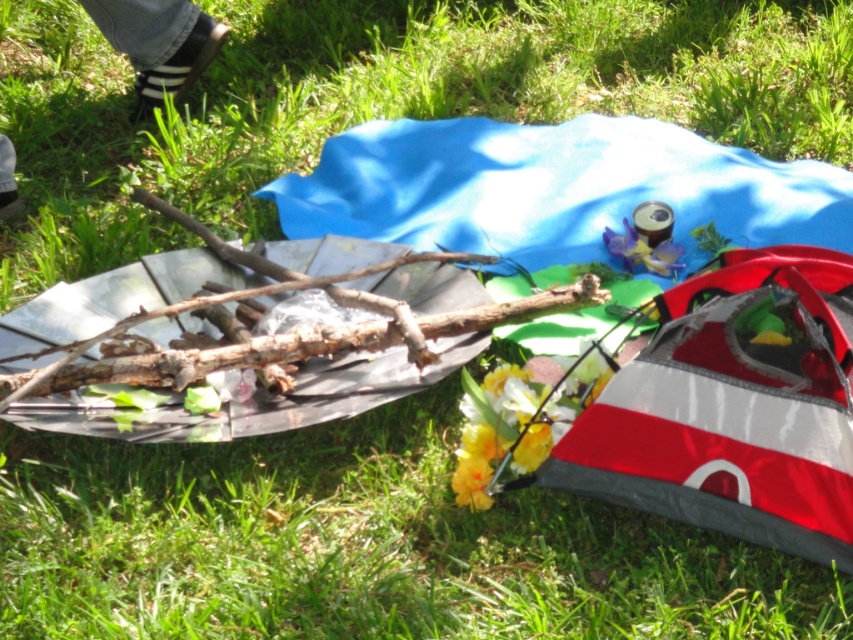
Measure the distance from yellow artificial flower at center to black leather shoe at upper left.

A distance of 1.98 meters exists between yellow artificial flower at center and black leather shoe at upper left.

Between point (602, 352) and point (7, 193), which one is positioned in front?

Point (602, 352)

Between point (476, 477) and point (122, 28), which one is positioned behind?

Positioned behind is point (122, 28).

Locate an element on the screen. yellow artificial flower at center is located at coordinates (518, 420).

How much distance is there between black leather shoe at upper left and yellow matte flower at center?

The distance of black leather shoe at upper left from yellow matte flower at center is 5.34 feet.

Is black leather shoe at upper left above yellow matte flower at center?

Yes.

Find the location of a particular element. This screenshot has width=853, height=640. black leather shoe at upper left is located at coordinates (158, 42).

Does yellow artificial flower at center have a lesser width compared to yellow matte flower at center?

No, yellow artificial flower at center is not thinner than yellow matte flower at center.

Is yellow artificial flower at center bigger than yellow matte flower at center?

Indeed, yellow artificial flower at center has a larger size compared to yellow matte flower at center.

Image resolution: width=853 pixels, height=640 pixels. What do you see at coordinates (518, 420) in the screenshot?
I see `yellow artificial flower at center` at bounding box center [518, 420].

Locate an element on the screen. This screenshot has width=853, height=640. yellow artificial flower at center is located at coordinates (518, 420).